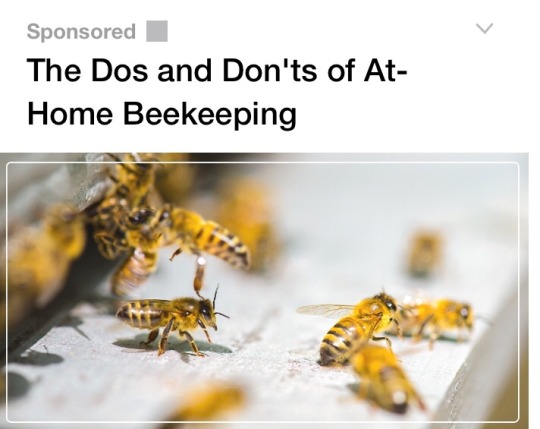
Identify the location of table. (271, 338).